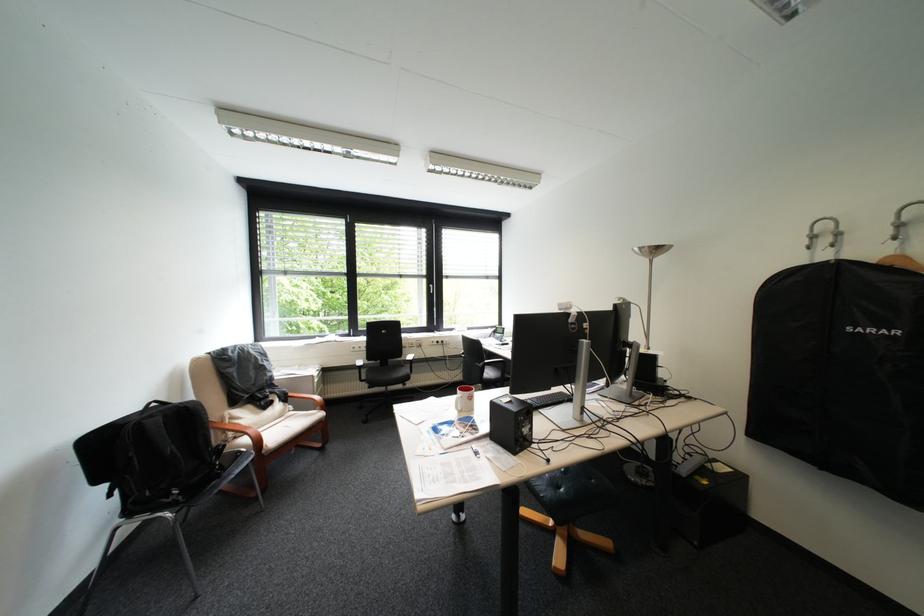
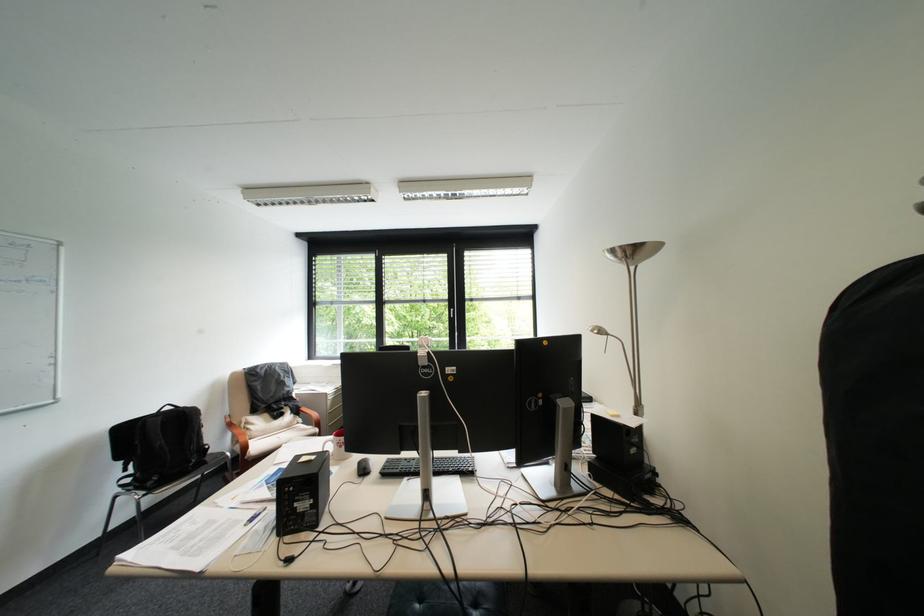
Find the pixel in the second image that matches the point at 651,248 in the first image.

(625, 252)